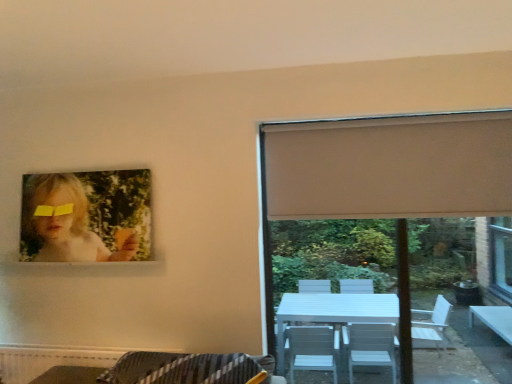
Question: Considering the relative positions of yellow matte glasses at upper left and white matte window at upper right in the image provided, is yellow matte glasses at upper left to the right of white matte window at upper right from the viewer's perspective?

Choices:
 (A) yes
 (B) no

Answer: (B)

Question: Is yellow matte glasses at upper left positioned behind white matte window at upper right?

Choices:
 (A) no
 (B) yes

Answer: (B)

Question: From the image's perspective, is yellow matte glasses at upper left below white matte window at upper right?

Choices:
 (A) yes
 (B) no

Answer: (B)

Question: Is yellow matte glasses at upper left thinner than white matte window at upper right?

Choices:
 (A) no
 (B) yes

Answer: (B)

Question: Is yellow matte glasses at upper left outside of white matte window at upper right?

Choices:
 (A) no
 (B) yes

Answer: (B)

Question: Does yellow matte glasses at upper left have a greater width compared to white matte window at upper right?

Choices:
 (A) no
 (B) yes

Answer: (A)

Question: Does matte paper portrait at upper left come behind yellow matte glasses at upper left?

Choices:
 (A) no
 (B) yes

Answer: (A)

Question: Can you confirm if matte paper portrait at upper left is positioned to the left of yellow matte glasses at upper left?

Choices:
 (A) no
 (B) yes

Answer: (A)

Question: Is matte paper portrait at upper left completely or partially outside of yellow matte glasses at upper left?

Choices:
 (A) no
 (B) yes

Answer: (B)

Question: Does matte paper portrait at upper left contain yellow matte glasses at upper left?

Choices:
 (A) no
 (B) yes

Answer: (B)

Question: From a real-world perspective, is matte paper portrait at upper left on top of yellow matte glasses at upper left?

Choices:
 (A) yes
 (B) no

Answer: (B)

Question: Is matte paper portrait at upper left facing away from yellow matte glasses at upper left?

Choices:
 (A) yes
 (B) no

Answer: (A)

Question: Is beige fabric curtain at right oriented away from yellow matte glasses at upper left?

Choices:
 (A) yes
 (B) no

Answer: (B)